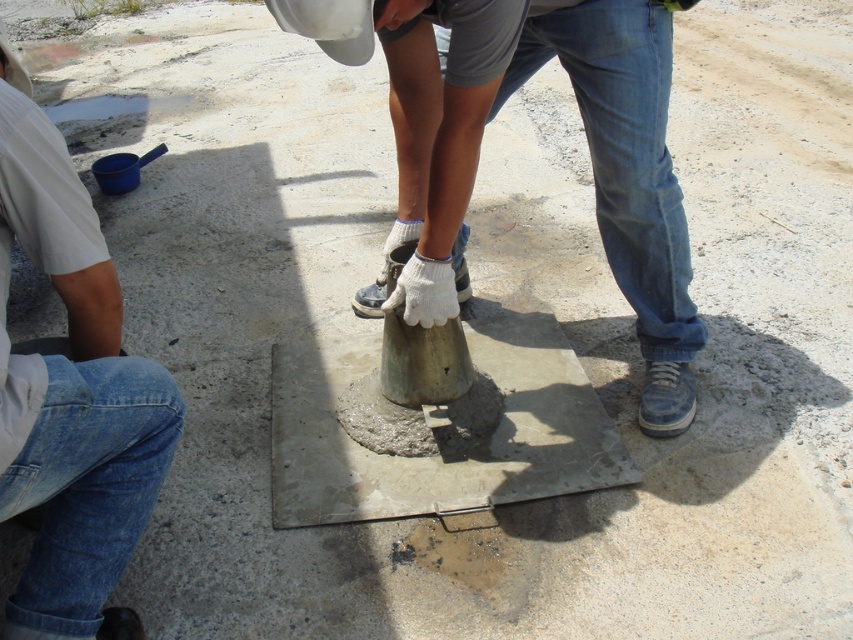
You are a construction worker standing near the metallic gray cone at center and the denim jeans at left. You need to place a tool that is 1 meter wide between them. Will there be enough space?

The metallic gray cone at center is wider than the denim jeans at left. However, since the exact distance between them isn

You are a construction worker who needs to move the metallic gray cone at center to a location 1 meter away from your current position. If you are standing at the denim jeans at left, will you be able to move the cone to the required distance without moving your feet?

The metallic gray cone at center and denim jeans at left are 82.14 centimeters apart. Since you need to move the cone 1 meter away from your current position, which is 100 centimeters, and the distance between you and the cone is only 82.14 centimeters, you cannot reach it without moving your feet to cover the remaining distance.